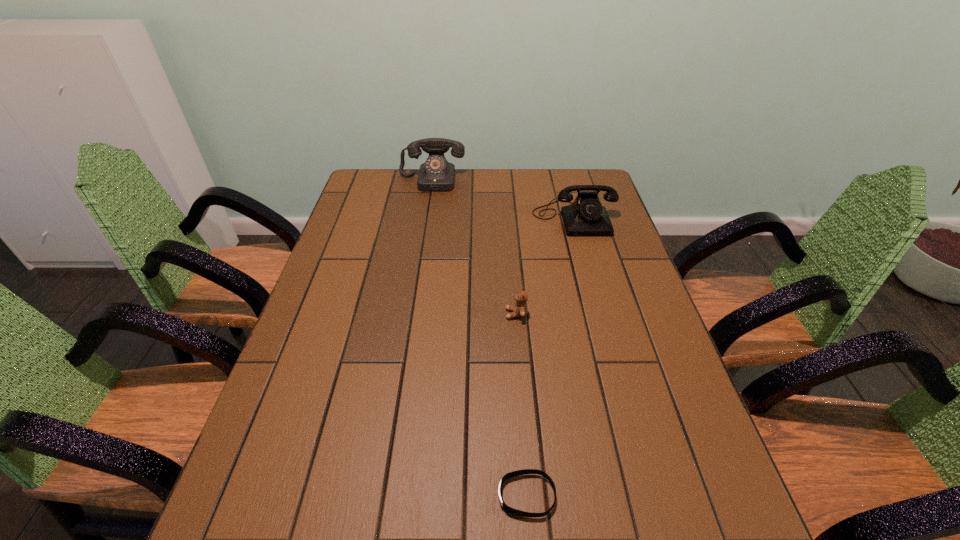
Where is `free point located 0.250m on the front-facing side of the teddy bear`? free point located 0.250m on the front-facing side of the teddy bear is located at coordinates (410, 314).

You are a GUI agent. You are given a task and a screenshot of the screen. Output one action in this format:
    pyautogui.click(x=<x>, y=<y>)
    Task: Click on the vacant area situated on the front-facing side of the teddy bear
    The image size is (960, 540).
    Given the screenshot: What is the action you would take?
    pyautogui.click(x=414, y=314)

Identify the location of vacant region located on the front-facing side of the teddy bear. This screenshot has width=960, height=540. (437, 314).

I want to click on free point located on the display of the nearest object, so click(x=308, y=495).

At what (x,y) coordinates should I click in order to perform the action: click on vacant area situated 0.260m on the display of the nearest object. Please return your answer as a coordinate pair (x, y). Image resolution: width=960 pixels, height=540 pixels. Looking at the image, I should click on (357, 495).

At what (x,y) coordinates should I click in order to perform the action: click on free spot located on the display of the nearest object. Please return your answer as a coordinate pair (x, y). This screenshot has width=960, height=540. Looking at the image, I should click on point(395,495).

Where is `object that is at the left edge`? object that is at the left edge is located at coordinates (436, 174).

Where is `object situated at the right edge`? This screenshot has height=540, width=960. object situated at the right edge is located at coordinates (586, 216).

This screenshot has width=960, height=540. I want to click on object that is at the far left corner, so click(436, 174).

This screenshot has height=540, width=960. Identify the location of object that is at the far right corner. (586, 216).